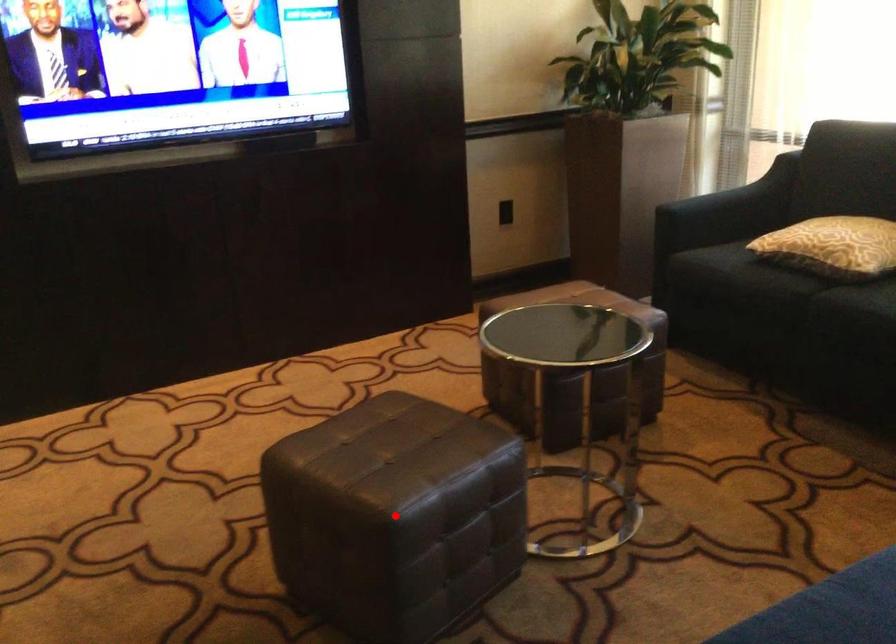
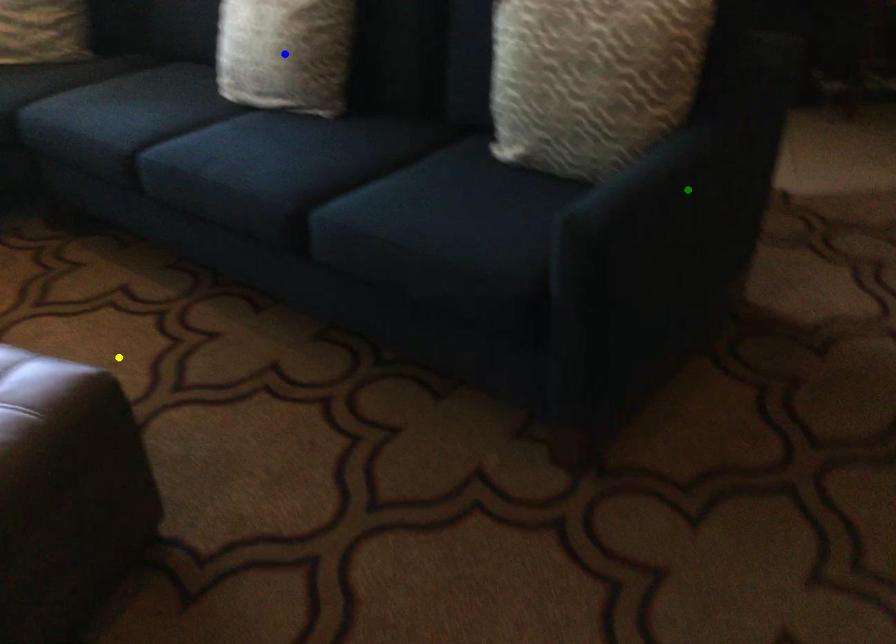
Question: I am providing you with two images of the same scene from different viewpoints. A red point is marked on the first image. You are given multiple points on the second image. Which point in image 2 represents the same 3d spot as the red point in image 1?

Choices:
 (A) yellow point
 (B) green point
 (C) blue point

Answer: (A)